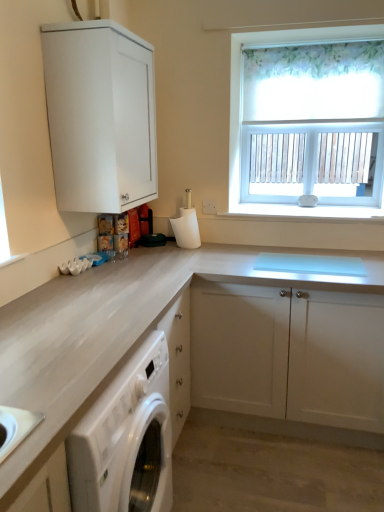
Question: Is white matte cabinet at upper left, marked as the 1th cabinetry in a top-to-bottom arrangement, taller or shorter than white matte cabinet at center, the 1th cabinetry from the bottom?

Choices:
 (A) tall
 (B) short

Answer: (B)

Question: Considering their positions, is white matte cabinet at upper left, placed as the second cabinetry when sorted from bottom to top, located in front of or behind white matte cabinet at center, positioned as the 2th cabinetry in top-to-bottom order?

Choices:
 (A) front
 (B) behind

Answer: (A)

Question: Based on their relative distances, which object is farther from the white matte cabinet at center, the 1th cabinetry from the bottom?

Choices:
 (A) white matte cabinet at upper left, placed as the second cabinetry when sorted from bottom to top
 (B) white floral roller blind at upper right
 (C) white glossy washing machine at lower left

Answer: (B)

Question: Which object is the farthest from the white matte cabinet at upper left, placed as the second cabinetry when sorted from bottom to top?

Choices:
 (A) white floral roller blind at upper right
 (B) white matte cabinet at center, positioned as the 2th cabinetry in top-to-bottom order
 (C) white glossy washing machine at lower left

Answer: (C)